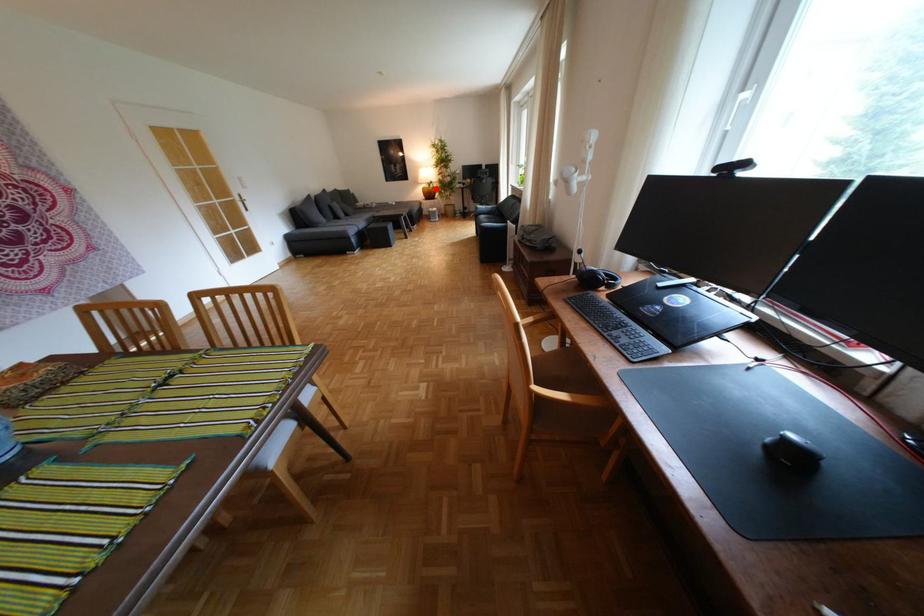
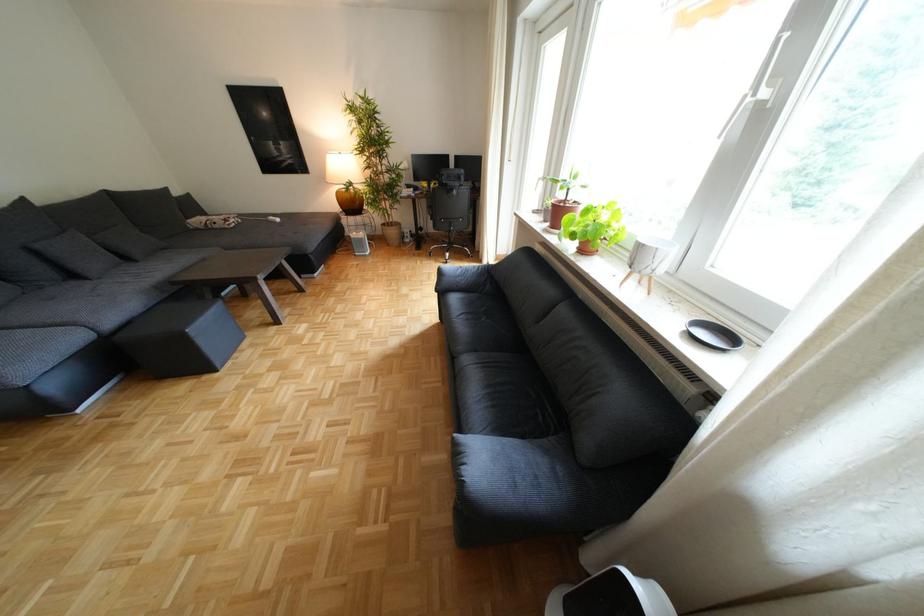
Question: I am providing you with two images of the same scene from different viewpoints. Image1 has a red point marked. In image2, the corresponding 3D location appears at what relative position? Reply with the corresponding letter.

Choices:
 (A) Closer
 (B) Farther

Answer: (B)